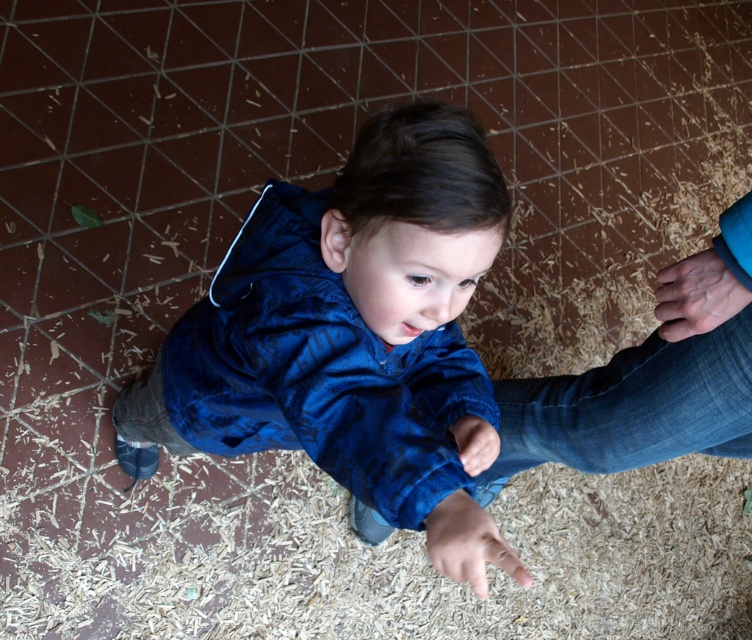
You are a photographer trying to capture the child in the blue velvety jacket at center. Where should you focus your camera to ensure the jacket is in the center of the image?

You should focus your camera at the coordinates point (352, 337) where the blue velvety jacket at center is located.

You are a photographer trying to capture a candid shot of the child and the adult. You notice the denim at lower right and the smooth skin hand at center in the frame. Based on their sizes in the image, which object would appear larger to the camera?

The denim at lower right appears much larger than the smooth skin hand at center in the image because it is much taller.

You are a photographer trying to capture the child in focus while blurring the background. Since the blue velvety jacket at center and denim at lower right are in the scene, which object should you focus on to ensure the child is sharp?

You should focus on the blue velvety jacket at center because it is closer to the viewer than the denim at lower right, ensuring the child remains in sharp focus while the background blurs.